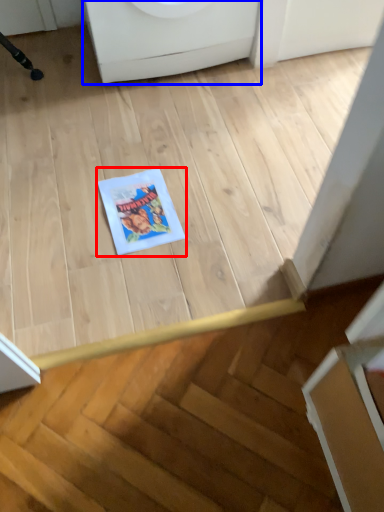
Question: Which object appears closest to the camera in this image, comic book (highlighted by a red box) or washing machine (highlighted by a blue box)?

Choices:
 (A) comic book
 (B) washing machine

Answer: (A)